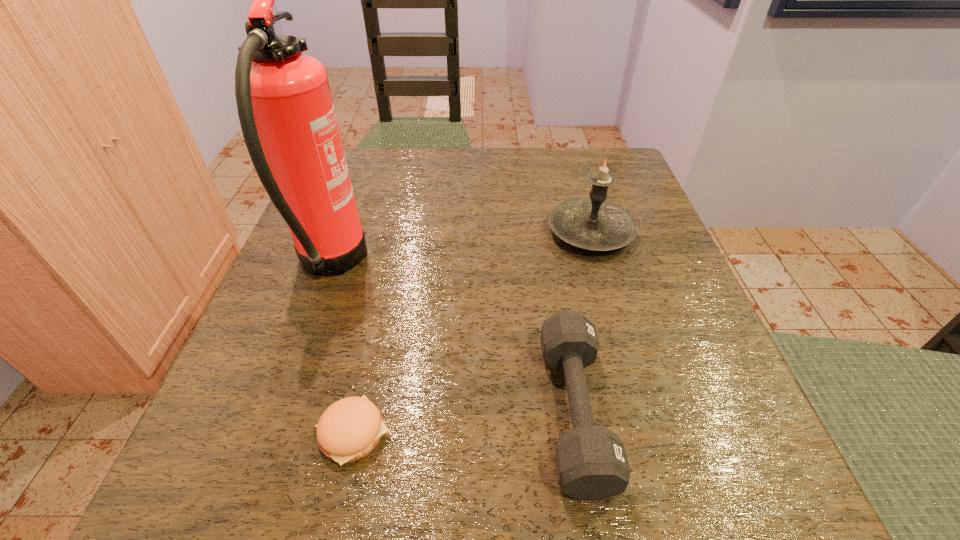
Image resolution: width=960 pixels, height=540 pixels. I want to click on fire extinguisher at the left edge, so click(285, 107).

Identify the location of patty that is at the left edge. (349, 429).

At what (x,y) coordinates should I click in order to perform the action: click on object that is at the right edge. Please return your answer as a coordinate pair (x, y). Looking at the image, I should click on (593, 223).

I want to click on object that is at the near left corner, so click(349, 429).

Identify the location of free space at the far edge. The image size is (960, 540). (455, 193).

You are a GUI agent. You are given a task and a screenshot of the screen. Output one action in this format:
    pyautogui.click(x=<x>, y=<y>)
    Task: Click on the vacant space at the left edge of the desktop
    
    Given the screenshot: What is the action you would take?
    pyautogui.click(x=227, y=420)

Find the location of a particular element. vacant space at the right edge of the desktop is located at coordinates (638, 246).

Where is `vacant space at the far left corner of the desktop`? This screenshot has width=960, height=540. vacant space at the far left corner of the desktop is located at coordinates (369, 157).

Find the location of a particular element. vacant space at the far right corner is located at coordinates (617, 155).

In the image, there is a desktop. Where is `vacant space at the near right corner`? vacant space at the near right corner is located at coordinates (717, 448).